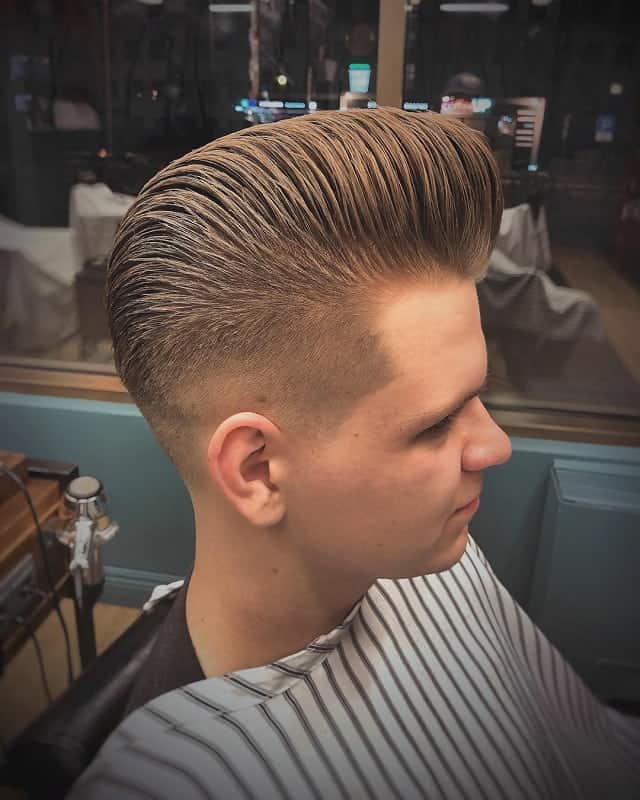
Where is `black cord`? The height and width of the screenshot is (800, 640). black cord is located at coordinates (44, 552).